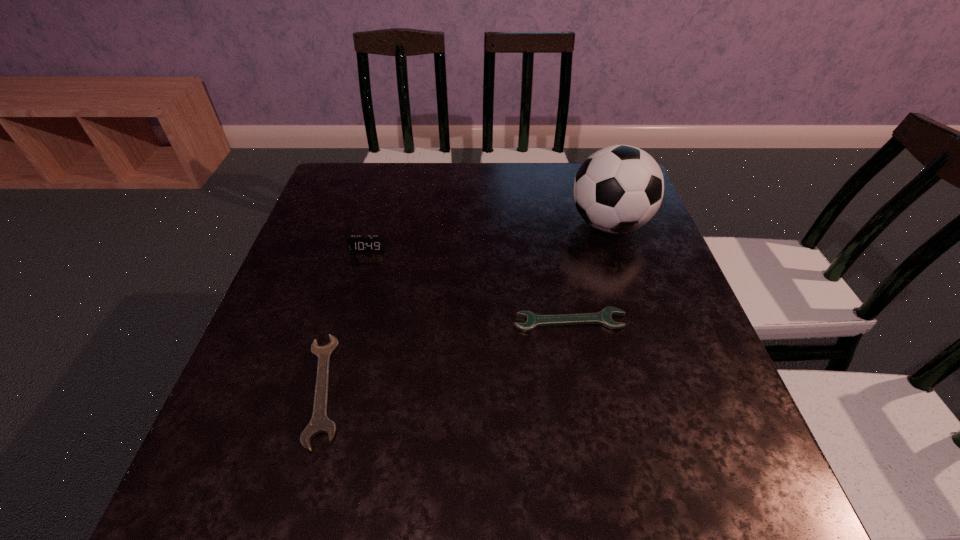
Where is `soccer ball`? This screenshot has height=540, width=960. soccer ball is located at coordinates (618, 189).

Locate an element on the screen. the second tallest object is located at coordinates (356, 243).

Find the location of a particular element. the second nearest object is located at coordinates (604, 318).

Identify the location of the right wrench. (604, 318).

Locate an element on the screen. the left wrench is located at coordinates (320, 423).

The height and width of the screenshot is (540, 960). Identify the location of the nearer wrench. (320, 423).

This screenshot has height=540, width=960. I want to click on vacant space located 0.210m on the left of the tallest object, so click(489, 224).

Find the location of a particular element. free location located on the front-facing side of the third shortest object is located at coordinates point(348,318).

Locate an element on the screen. This screenshot has width=960, height=540. vacant space positioned on the back of the farther wrench is located at coordinates (547, 201).

Locate an element on the screen. vacant position located 0.070m on the front of the nearer wrench is located at coordinates (292, 497).